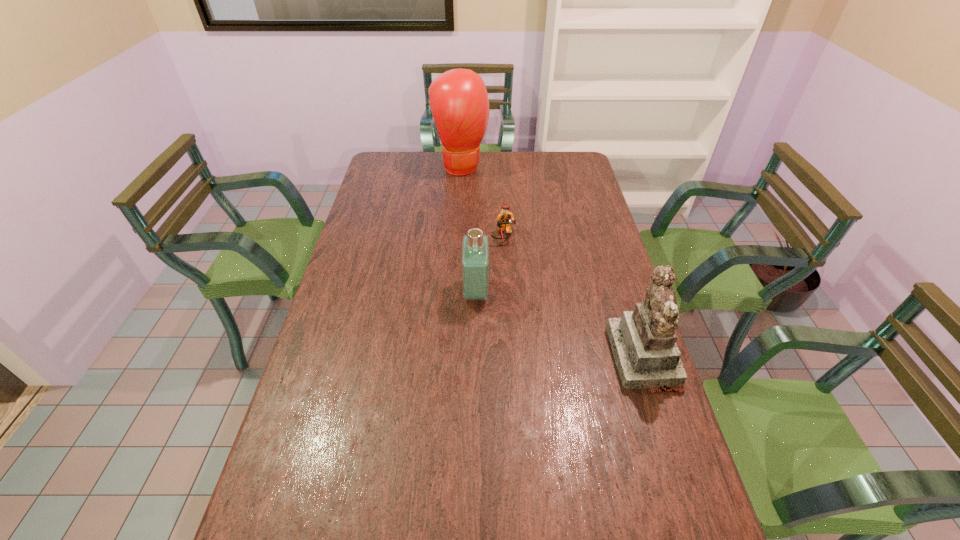
I want to click on vacant region between the shortest object and the second tallest object, so click(x=573, y=297).

This screenshot has width=960, height=540. I want to click on free space between the nearest object and the third farthest object, so click(x=560, y=325).

Where is `vacant space that's between the farthest object and the second tallest object`? The image size is (960, 540). vacant space that's between the farthest object and the second tallest object is located at coordinates 552,262.

Select which object appears as the second closest to the boxing glove. Please provide its 2D coordinates. Your answer should be formatted as a tuple, i.e. [(x, y)], where the tuple contains the x and y coordinates of a point satisfying the conditions above.

[(475, 249)]

Point out which object is positioned as the second nearest to the nearest object. Please provide its 2D coordinates. Your answer should be formatted as a tuple, i.e. [(x, y)], where the tuple contains the x and y coordinates of a point satisfying the conditions above.

[(505, 219)]